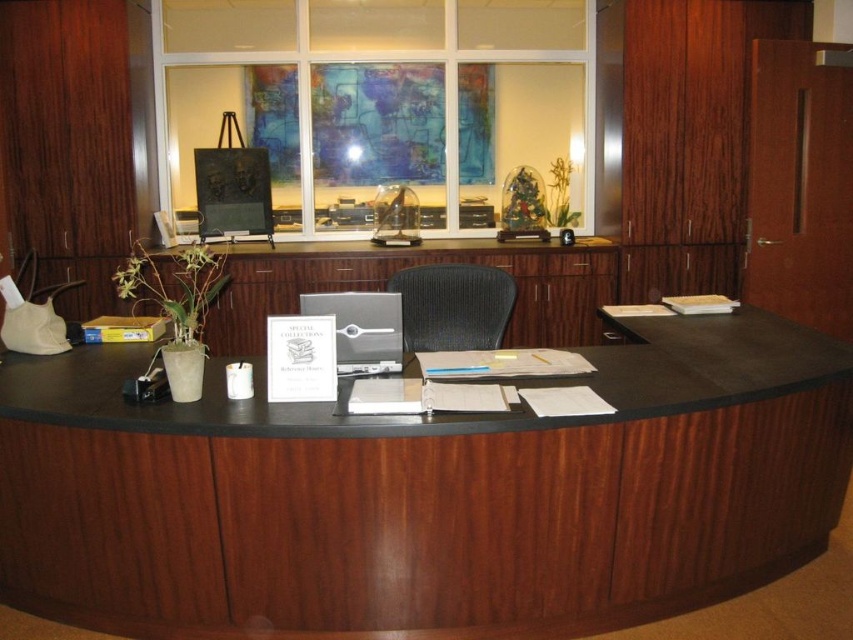
You need to place a rectangular box that is 1 meter long on the wooden desk at center. Considering the desk and laptop, will the box fit horizontally on the desk without overlapping the satin silver laptop at center?

The wooden desk at center is wider than the satin silver laptop at center. However, the description only mentions the desk is wider but does not provide specific measurements. Since the laptop is at the center, there might be enough space on either side to place the box horizontally. But without knowing the exact dimensions of the desk and the box, it is uncertain if it will fit without overlapping. The answer is inconclusive based on the given information.

You are a visitor at the reception area and need to place a folder on the wooden desk at center. However, there is a laptop in the way. Where should you move the satin silver laptop at center to make space?

Since the wooden desk at center is to the right of the satin silver laptop at center, you should move the laptop to the left to create space on the desk.